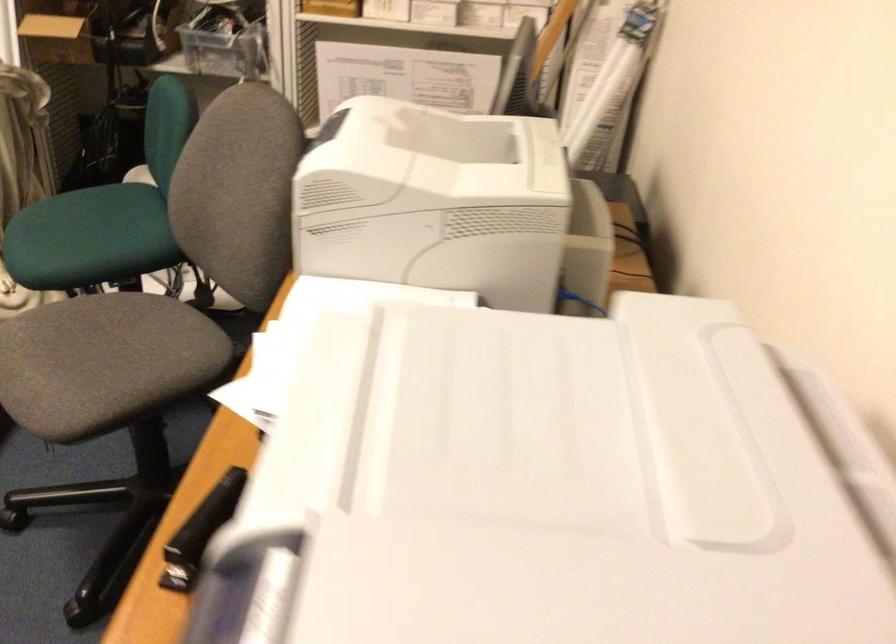
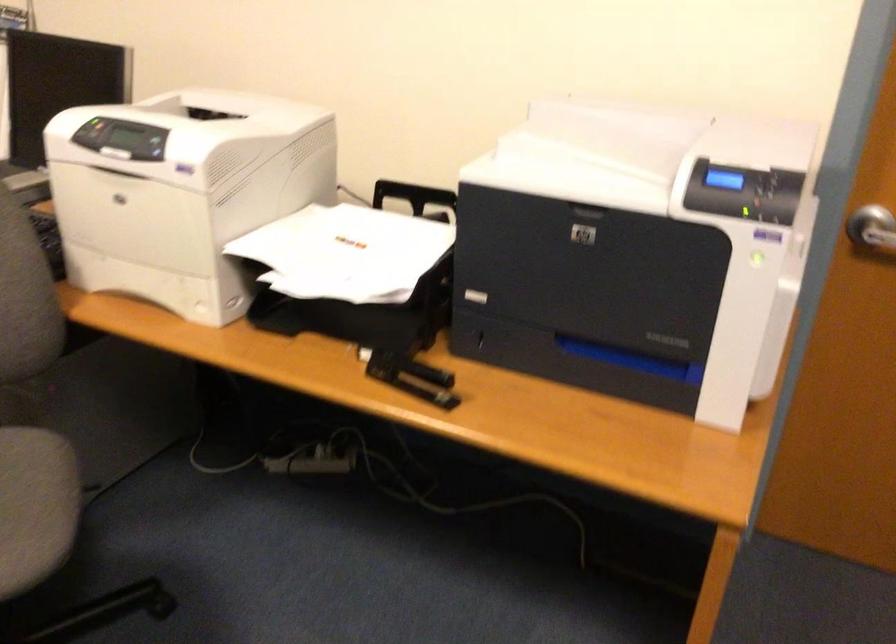
The point at (331, 122) is marked in the first image. Where is the corresponding point in the second image?

(91, 131)